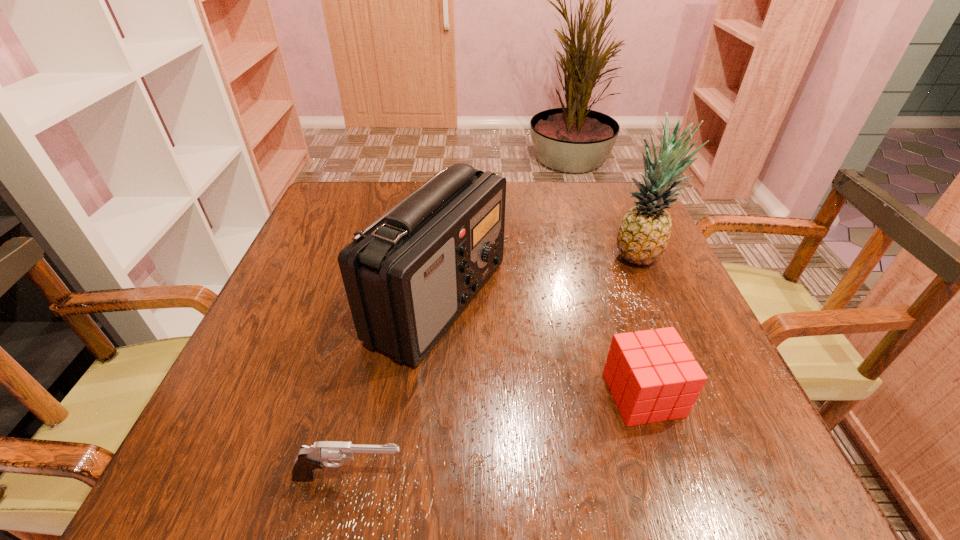
Locate an element on the screen. The height and width of the screenshot is (540, 960). pineapple that is positioned at the right edge is located at coordinates (643, 235).

Where is `cube located at the right edge`? This screenshot has height=540, width=960. cube located at the right edge is located at coordinates (653, 376).

Identify the location of object that is at the near left corner. Image resolution: width=960 pixels, height=540 pixels. (310, 458).

This screenshot has width=960, height=540. What are the coordinates of `free space at the far edge` in the screenshot? It's located at (571, 196).

Identify the location of vacant position at the near edge of the desktop. (613, 482).

Image resolution: width=960 pixels, height=540 pixels. I want to click on vacant space at the left edge of the desktop, so point(321,314).

Image resolution: width=960 pixels, height=540 pixels. What are the coordinates of `free space at the right edge of the desktop` in the screenshot? It's located at (663, 289).

Locate an element on the screen. The image size is (960, 540). free space at the far left corner is located at coordinates (320, 200).

This screenshot has width=960, height=540. Find the location of `vacant space at the far right corner`. vacant space at the far right corner is located at coordinates click(x=624, y=213).

This screenshot has height=540, width=960. In the image, there is a desktop. Find the location of `blank space at the near right corner`. blank space at the near right corner is located at coordinates (754, 437).